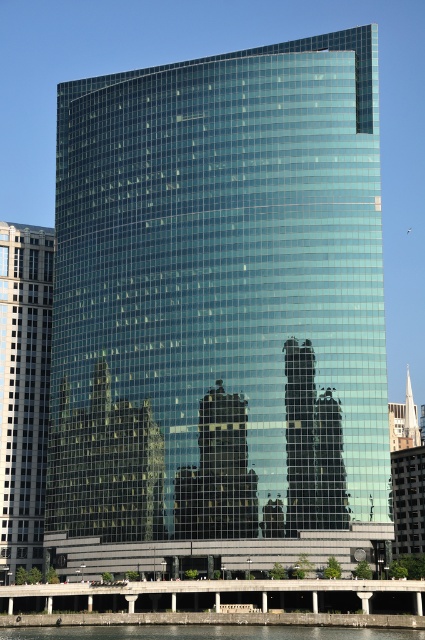
Does transparent glass skyscraper at center appear on the right side of clear glass water at lower center?

In fact, transparent glass skyscraper at center is to the left of clear glass water at lower center.

Which of these two, transparent glass skyscraper at center or clear glass water at lower center, stands shorter?

clear glass water at lower center

Which is behind, point (44, 387) or point (384, 630)?

The point (44, 387) is more distant.

Identify the location of transparent glass skyscraper at center. Image resolution: width=425 pixels, height=640 pixels. (23, 392).

Can you confirm if transparent glass building at center is thinner than transparent glass skyscraper at center?

No.

What do you see at coordinates (220, 312) in the screenshot? I see `transparent glass building at center` at bounding box center [220, 312].

In order to click on transparent glass building at center in this screenshot , I will do `click(220, 312)`.

Find the location of a particular element. transparent glass building at center is located at coordinates (220, 312).

Consider the image. Which of these two, transparent glass building at center or clear glass water at lower center, stands shorter?

clear glass water at lower center

Find the location of a particular element. This screenshot has height=640, width=425. transparent glass building at center is located at coordinates (220, 312).